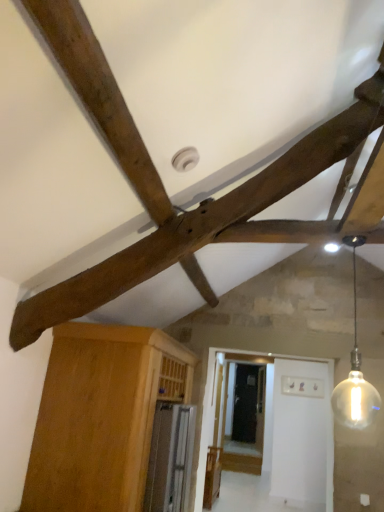
Question: From a real-world perspective, does wooden cabinet at lower left sit lower than wooden beam at upper center?

Choices:
 (A) yes
 (B) no

Answer: (A)

Question: Is wooden cabinet at lower left thinner than wooden beam at upper center?

Choices:
 (A) yes
 (B) no

Answer: (B)

Question: Is wooden cabinet at lower left wider than wooden beam at upper center?

Choices:
 (A) yes
 (B) no

Answer: (A)

Question: Is wooden cabinet at lower left positioned before wooden beam at upper center?

Choices:
 (A) no
 (B) yes

Answer: (A)

Question: Can wooden beam at upper center be found inside wooden cabinet at lower left?

Choices:
 (A) no
 (B) yes

Answer: (A)

Question: Could you tell me if wooden cabinet at lower left is turned towards wooden beam at upper center?

Choices:
 (A) yes
 (B) no

Answer: (B)

Question: Considering the relative positions of translucent glass bulb at upper right and wooden beam at upper center in the image provided, is translucent glass bulb at upper right to the right of wooden beam at upper center from the viewer's perspective?

Choices:
 (A) no
 (B) yes

Answer: (B)

Question: Could wooden beam at upper center be considered to be inside translucent glass bulb at upper right?

Choices:
 (A) no
 (B) yes

Answer: (A)

Question: From a real-world perspective, is translucent glass bulb at upper right located higher than wooden beam at upper center?

Choices:
 (A) no
 (B) yes

Answer: (A)

Question: From the image's perspective, is translucent glass bulb at upper right on wooden beam at upper center?

Choices:
 (A) no
 (B) yes

Answer: (A)

Question: Can you see translucent glass bulb at upper right touching wooden beam at upper center?

Choices:
 (A) yes
 (B) no

Answer: (B)

Question: Is translucent glass bulb at upper right smaller than wooden beam at upper center?

Choices:
 (A) yes
 (B) no

Answer: (A)

Question: Could you tell me if wooden beam at upper center is facing translucent glass bulb at upper right?

Choices:
 (A) yes
 (B) no

Answer: (A)